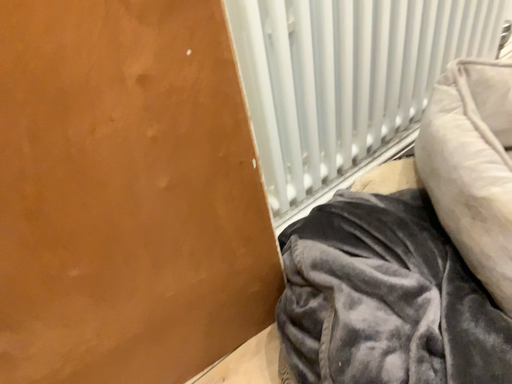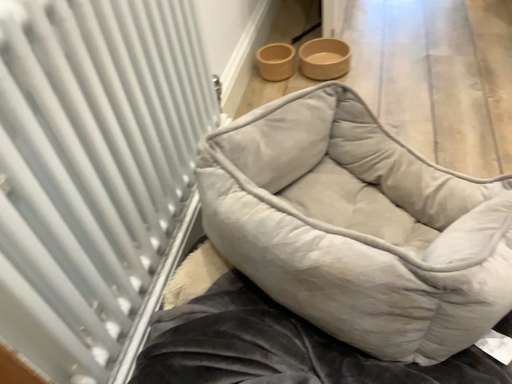
Question: How did the camera likely rotate when shooting the video?

Choices:
 (A) rotated downward
 (B) rotated upward

Answer: (B)